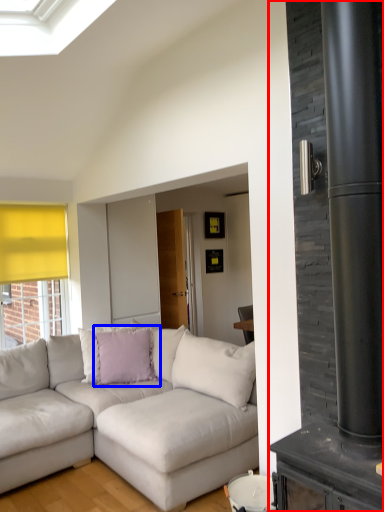
Question: Which object is further to the camera taking this photo, fireplace (highlighted by a red box) or pillow (highlighted by a blue box)?

Choices:
 (A) fireplace
 (B) pillow

Answer: (B)